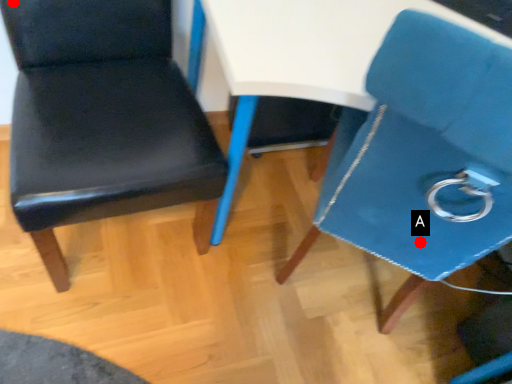
Question: Two points are circled on the image, labeled by A and B beside each circle. Which point is closer to the camera?

Choices:
 (A) A is closer
 (B) B is closer

Answer: (A)